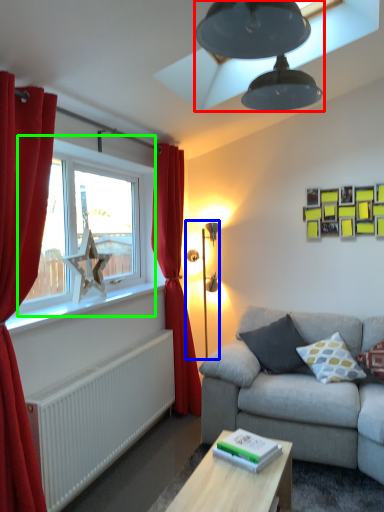
Question: Considering the real-world distances, which object is closest to lamp (highlighted by a red box)? table lamp (highlighted by a blue box) or window (highlighted by a green box).

Choices:
 (A) table lamp
 (B) window

Answer: (B)